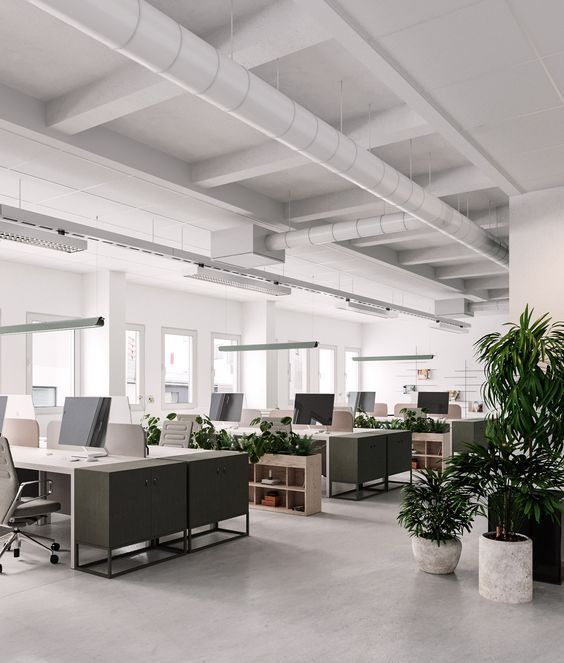
Image resolution: width=564 pixels, height=663 pixels. Find the location of `monitors`. monitors is located at coordinates (305, 404), (210, 398), (86, 414), (0, 402), (359, 402), (444, 398).